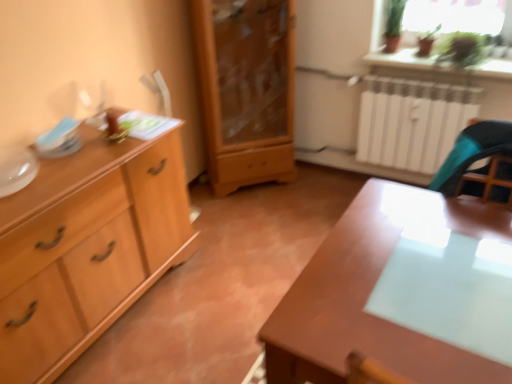
Find the location of a particular element. The image size is (512, 384). vacant space situated above glossy wood table at center (from a real-world perspective) is located at coordinates (384, 282).